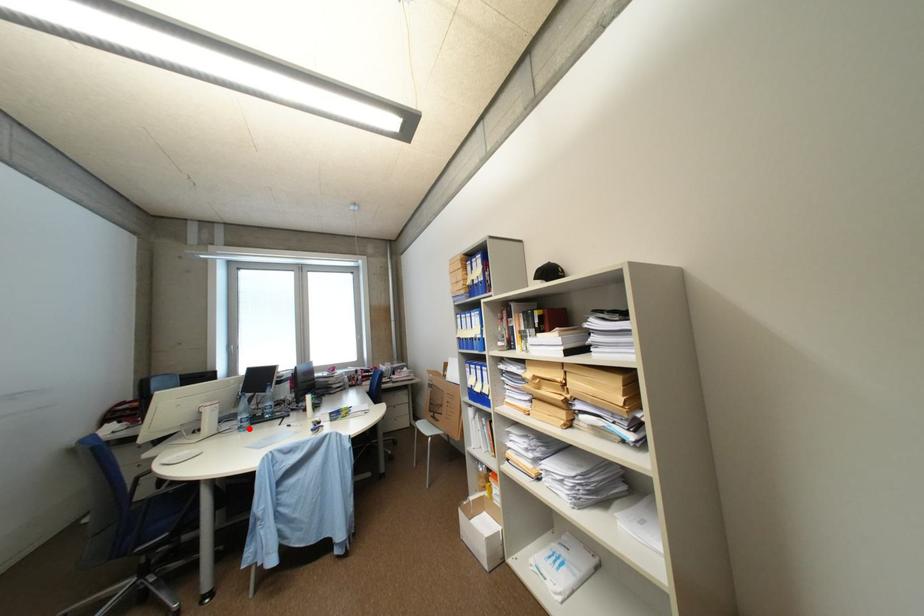
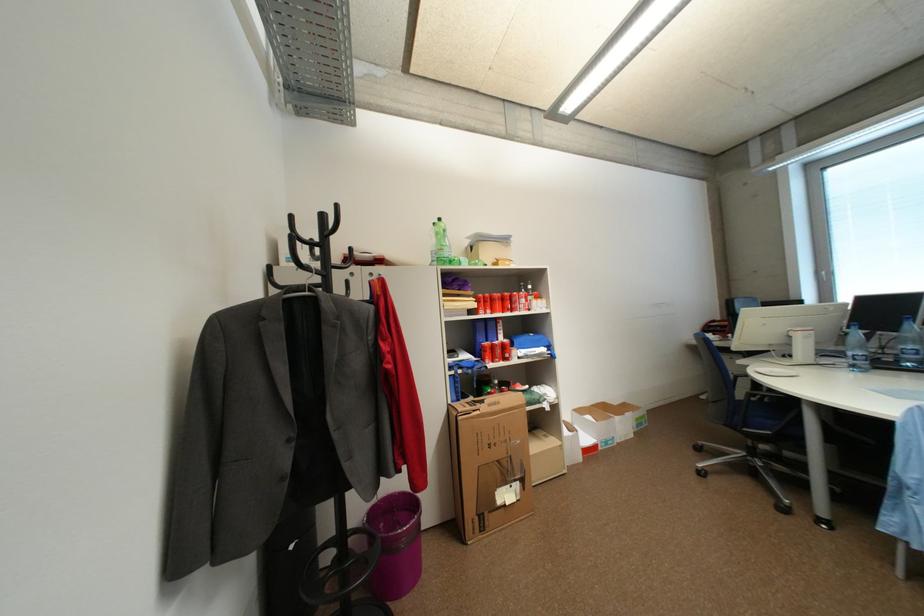
Find the pixel in the second image that matches the highlighted location in the first image.

(861, 367)